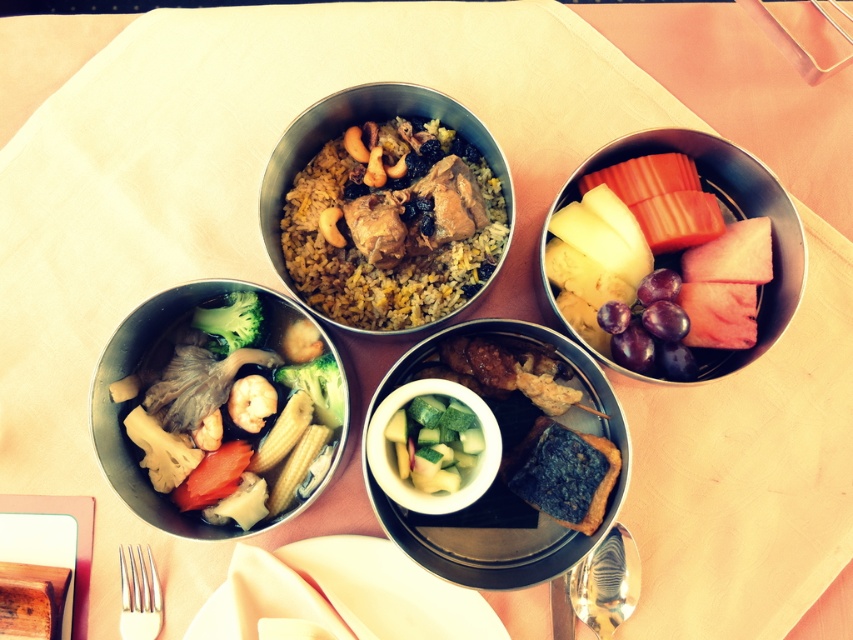
Question: Does silver metallic fork at lower left have a smaller size compared to green broccoli at lower left?

Choices:
 (A) no
 (B) yes

Answer: (B)

Question: Which object appears farthest from the camera in this image?

Choices:
 (A) metallic silver bowl at upper right
 (B) white fabric napkin at center
 (C) matte ceramic bowl at center
 (D) shiny metallic spoon at bottom right

Answer: (D)

Question: Considering the real-world distances, which object is closest to the shiny metallic bowl at lower left?

Choices:
 (A) metallic silver bowl at upper right
 (B) matte ceramic bowl at center
 (C) white fabric napkin at center

Answer: (C)

Question: Is white fabric napkin at center to the right of silver metallic fork at lower left from the viewer's perspective?

Choices:
 (A) no
 (B) yes

Answer: (B)

Question: Which point is closer to the camera?

Choices:
 (A) (329, 138)
 (B) (415, 451)

Answer: (B)

Question: Is white fabric napkin at center smaller than metallic silver bowl at upper right?

Choices:
 (A) no
 (B) yes

Answer: (B)